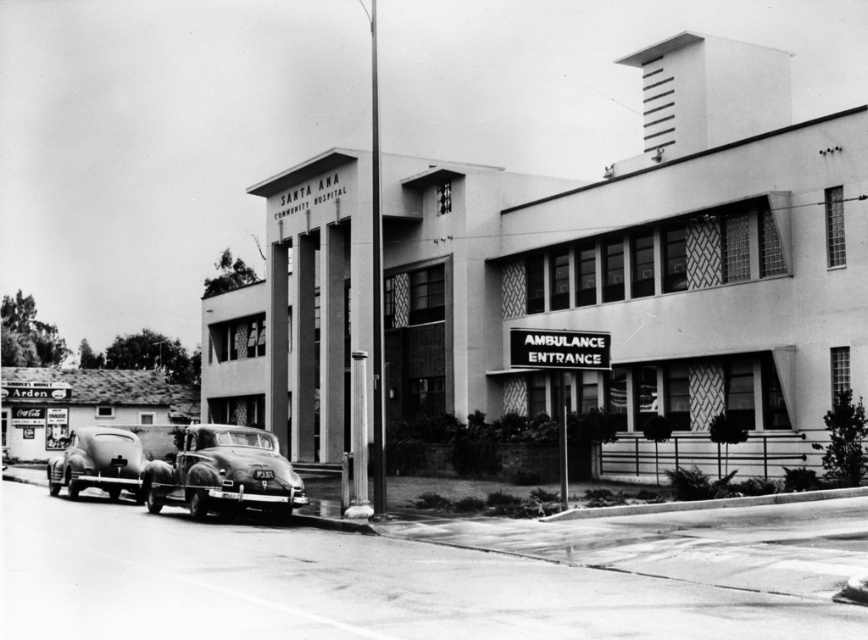
Question: Which point is closer to the camera?

Choices:
 (A) (140, 481)
 (B) (196, 456)

Answer: (B)

Question: Which object is farther from the camera taking this photo?

Choices:
 (A) shiny silver car at center
 (B) shiny chrome car at lower left

Answer: (B)

Question: Is shiny silver car at center smaller than shiny chrome car at lower left?

Choices:
 (A) no
 (B) yes

Answer: (B)

Question: Does shiny silver car at center appear on the right side of shiny chrome car at lower left?

Choices:
 (A) yes
 (B) no

Answer: (A)

Question: Does shiny silver car at center have a lesser width compared to shiny chrome car at lower left?

Choices:
 (A) yes
 (B) no

Answer: (A)

Question: Which of the following is the closest to the observer?

Choices:
 (A) shiny silver car at center
 (B) shiny chrome car at lower left

Answer: (A)